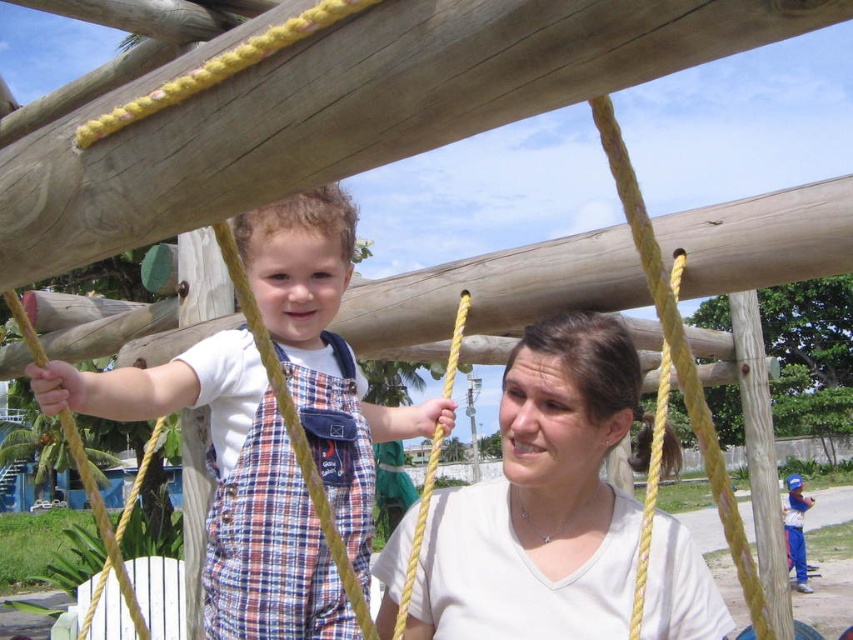
Is white matte shirt at center in front of blue denim pants at lower right?

That is True.

Does white matte shirt at center appear on the left side of blue denim pants at lower right?

Indeed, white matte shirt at center is positioned on the left side of blue denim pants at lower right.

Who is more distant from viewer, (602, 445) or (792, 476)?

The point (792, 476) is behind.

The width and height of the screenshot is (853, 640). Identify the location of white matte shirt at center. (541, 500).

Who is shorter, plaid overalls at center or blue denim pants at lower right?

Standing shorter between the two is blue denim pants at lower right.

Which is below, plaid overalls at center or blue denim pants at lower right?

blue denim pants at lower right is lower down.

This screenshot has width=853, height=640. In order to click on plaid overalls at center in this screenshot , I will do `click(230, 484)`.

Is plaid overalls at center bigger than white matte shirt at center?

Correct, plaid overalls at center is larger in size than white matte shirt at center.

Is point (281, 278) positioned in front of point (558, 356)?

Yes, point (281, 278) is closer to viewer.

Where is `plaid overalls at center`? The width and height of the screenshot is (853, 640). plaid overalls at center is located at coordinates (230, 484).